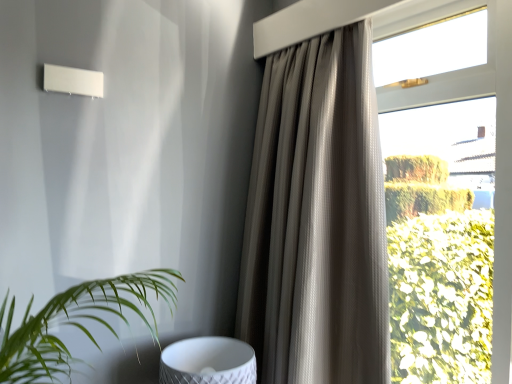
The image size is (512, 384). What do you see at coordinates (208, 362) in the screenshot?
I see `white textured swivel chair at lower center` at bounding box center [208, 362].

From the picture: Measure the distance between point (241, 374) and camera.

The distance of point (241, 374) from camera is 4.53 feet.

Where is `white textured swivel chair at lower center`? white textured swivel chair at lower center is located at coordinates (208, 362).

Image resolution: width=512 pixels, height=384 pixels. What do you see at coordinates (317, 219) in the screenshot?
I see `textured taupe curtain at upper right` at bounding box center [317, 219].

Image resolution: width=512 pixels, height=384 pixels. In order to click on textured taupe curtain at upper right in this screenshot , I will do (317, 219).

Measure the distance between textured taupe curtain at upper right and camera.

A distance of 4.21 feet exists between textured taupe curtain at upper right and camera.

Find the location of a particular element. The image size is (512, 384). white textured swivel chair at lower center is located at coordinates (208, 362).

Considering the relative positions of white textured swivel chair at lower center and textured taupe curtain at upper right in the image provided, is white textured swivel chair at lower center to the right of textured taupe curtain at upper right from the viewer's perspective?

No, white textured swivel chair at lower center is not to the right of textured taupe curtain at upper right.

Considering the positions of objects white textured swivel chair at lower center and textured taupe curtain at upper right in the image provided, who is in front, white textured swivel chair at lower center or textured taupe curtain at upper right?

textured taupe curtain at upper right is more forward.

Between point (233, 351) and point (342, 284), which one is positioned in front?

The point (342, 284) is closer.

From the image's perspective, is white textured swivel chair at lower center above textured taupe curtain at upper right?

No, from the image's perspective, white textured swivel chair at lower center is not above textured taupe curtain at upper right.

From a real-world perspective, is white textured swivel chair at lower center above or below textured taupe curtain at upper right?

In terms of real-world spatial position, white textured swivel chair at lower center is below textured taupe curtain at upper right.

Is white textured swivel chair at lower center wider than textured taupe curtain at upper right?

Yes, white textured swivel chair at lower center is wider than textured taupe curtain at upper right.

Does white textured swivel chair at lower center have a greater height compared to textured taupe curtain at upper right?

No, white textured swivel chair at lower center is not taller than textured taupe curtain at upper right.

Based on their sizes in the image, would you say white textured swivel chair at lower center is bigger or smaller than textured taupe curtain at upper right?

Considering their sizes, white textured swivel chair at lower center takes up less space than textured taupe curtain at upper right.

Is textured taupe curtain at upper right completely or partially inside white textured swivel chair at lower center?

No, textured taupe curtain at upper right is not surrounded by white textured swivel chair at lower center.

Is white textured swivel chair at lower center not near textured taupe curtain at upper right?

No.

Is textured taupe curtain at upper right at the back of white textured swivel chair at lower center?

No, textured taupe curtain at upper right is not at the back of white textured swivel chair at lower center.

How distant is white textured swivel chair at lower center from textured taupe curtain at upper right?

They are 18.14 inches apart.

Identify the location of swivel chair directly beneath the textured taupe curtain at upper right (from a real-world perspective). The image size is (512, 384). (208, 362).

Which is more to the left, textured taupe curtain at upper right or white textured swivel chair at lower center?

white textured swivel chair at lower center is more to the left.

Considering the positions of objects textured taupe curtain at upper right and white textured swivel chair at lower center in the image provided, who is behind, textured taupe curtain at upper right or white textured swivel chair at lower center?

white textured swivel chair at lower center.

Considering the positions of points (312, 95) and (196, 374), is point (312, 95) farther from camera compared to point (196, 374)?

Yes, point (312, 95) is behind point (196, 374).

From the image's perspective, who appears lower, textured taupe curtain at upper right or white textured swivel chair at lower center?

white textured swivel chair at lower center appears lower in the image.

From the picture: From a real-world perspective, is textured taupe curtain at upper right positioned over white textured swivel chair at lower center based on gravity?

Yes, from a real-world perspective, textured taupe curtain at upper right is on top of white textured swivel chair at lower center.

Can you confirm if textured taupe curtain at upper right is thinner than white textured swivel chair at lower center?

Yes, textured taupe curtain at upper right is thinner than white textured swivel chair at lower center.

From the picture: Is textured taupe curtain at upper right shorter than white textured swivel chair at lower center?

In fact, textured taupe curtain at upper right may be taller than white textured swivel chair at lower center.

Between textured taupe curtain at upper right and white textured swivel chair at lower center, which one has smaller size?

white textured swivel chair at lower center is smaller.

Would you say textured taupe curtain at upper right contains white textured swivel chair at lower center?

No, white textured swivel chair at lower center is not surrounded by textured taupe curtain at upper right.

Are textured taupe curtain at upper right and white textured swivel chair at lower center located far from each other?

No, textured taupe curtain at upper right is not far away from white textured swivel chair at lower center.

Is textured taupe curtain at upper right looking in the opposite direction of white textured swivel chair at lower center?

No.

What's the angular difference between textured taupe curtain at upper right and white textured swivel chair at lower center's facing directions?

The angular difference between textured taupe curtain at upper right and white textured swivel chair at lower center is 93.9 degrees.

The height and width of the screenshot is (384, 512). I want to click on curtain lying above the white textured swivel chair at lower center (from the image's perspective), so click(x=317, y=219).

The image size is (512, 384). I want to click on swivel chair behind the textured taupe curtain at upper right, so (x=208, y=362).

Where is `swivel chair below the textured taupe curtain at upper right (from the image's perspective)`? swivel chair below the textured taupe curtain at upper right (from the image's perspective) is located at coordinates (208, 362).